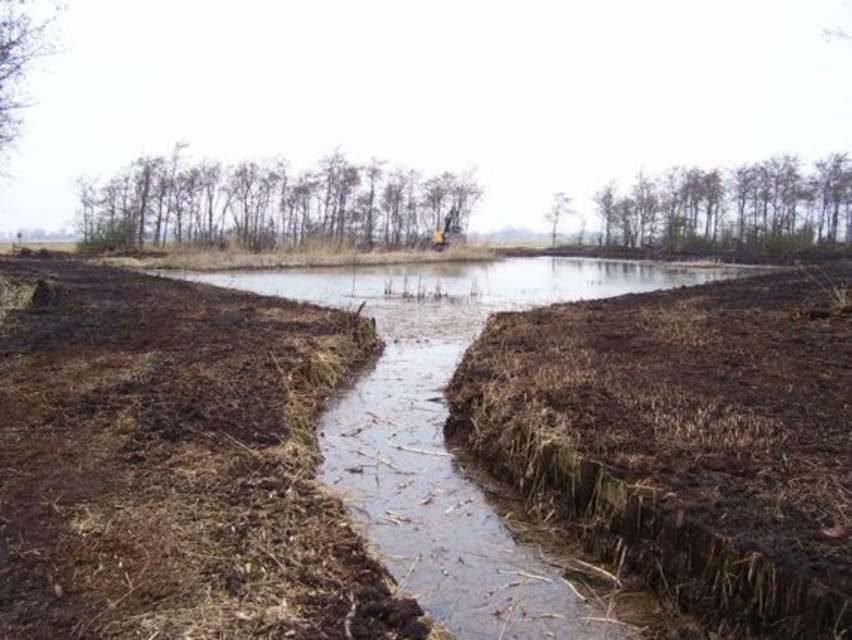
Question: Among these points, which one is farthest from the camera?

Choices:
 (A) (611, 509)
 (B) (534, 554)

Answer: (B)

Question: Can you confirm if brown dry grass at center is positioned to the right of brown muddy stream at center?

Choices:
 (A) no
 (B) yes

Answer: (B)

Question: Is brown dry grass at center smaller than brown muddy stream at center?

Choices:
 (A) no
 (B) yes

Answer: (B)

Question: Can you confirm if brown dry grass at center is positioned below brown muddy stream at center?

Choices:
 (A) no
 (B) yes

Answer: (B)

Question: Which object appears farthest from the camera in this image?

Choices:
 (A) brown dry grass at center
 (B) brown muddy stream at center

Answer: (B)